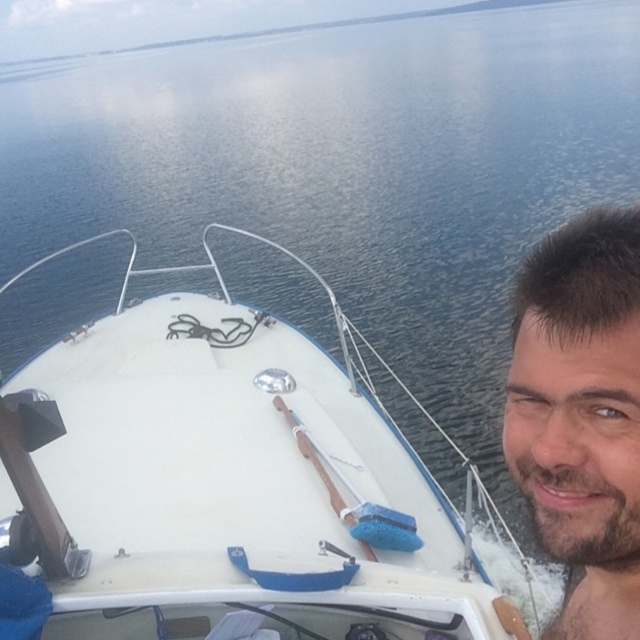
Question: Among these objects, which one is nearest to the camera?

Choices:
 (A) bearded man at right
 (B) white matte boat at center

Answer: (A)

Question: In this image, where is white matte boat at center located relative to bearded man at right?

Choices:
 (A) right
 (B) left

Answer: (B)

Question: Among these objects, which one is farthest from the camera?

Choices:
 (A) white matte boat at center
 (B) bearded man at right

Answer: (A)

Question: Can you confirm if white matte boat at center is wider than bearded man at right?

Choices:
 (A) no
 (B) yes

Answer: (B)

Question: Which of the following is the farthest from the observer?

Choices:
 (A) (538, 476)
 (B) (410, 625)

Answer: (B)

Question: Does white matte boat at center have a greater width compared to bearded man at right?

Choices:
 (A) yes
 (B) no

Answer: (A)